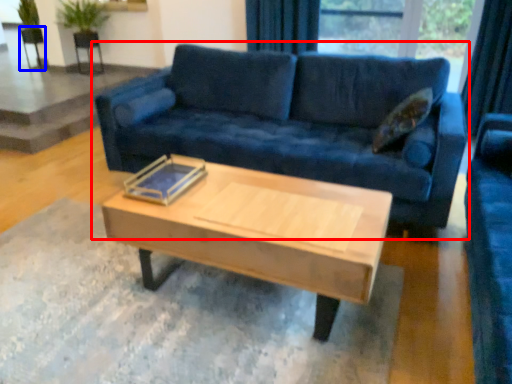
Question: Which point is further to the camera, studio couch (highlighted by a red box) or armchair (highlighted by a blue box)?

Choices:
 (A) studio couch
 (B) armchair

Answer: (B)